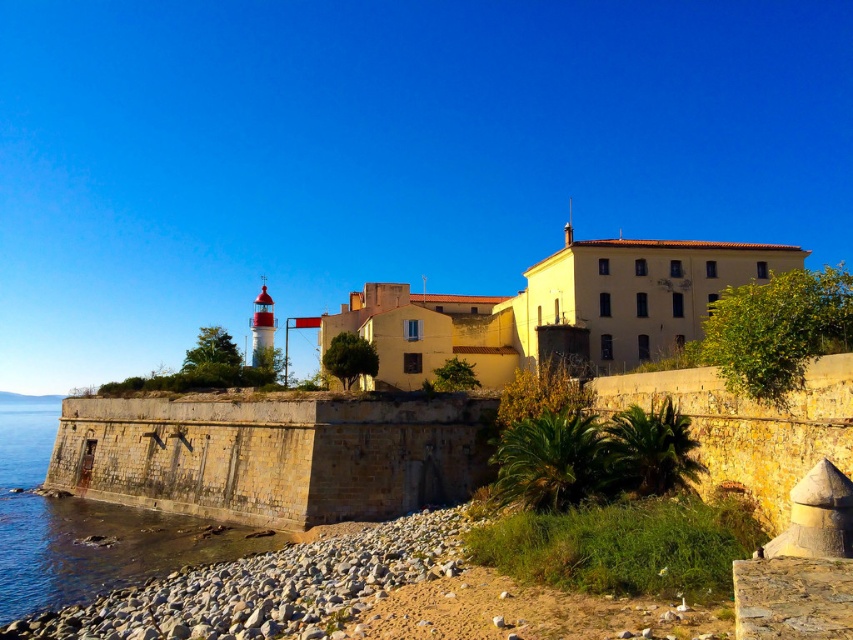
Question: Which point is closer to the camera taking this photo?

Choices:
 (A) (169, 568)
 (B) (332, 556)
 (C) (520, 301)

Answer: (B)

Question: From the image, what is the correct spatial relationship of gray gravel at lower left in relation to gray stone water at lower left?

Choices:
 (A) above
 (B) below

Answer: (A)

Question: Does gray gravel at lower left come in front of gray stone water at lower left?

Choices:
 (A) yes
 (B) no

Answer: (A)

Question: Which of the following is the closest to the observer?

Choices:
 (A) gray gravel at lower left
 (B) gray stone water at lower left

Answer: (A)

Question: Which object is the farthest from the gray stone water at lower left?

Choices:
 (A) gray gravel at lower left
 (B) yellow matte building at center

Answer: (B)

Question: Can you confirm if yellow matte building at center is bigger than gray stone water at lower left?

Choices:
 (A) no
 (B) yes

Answer: (A)